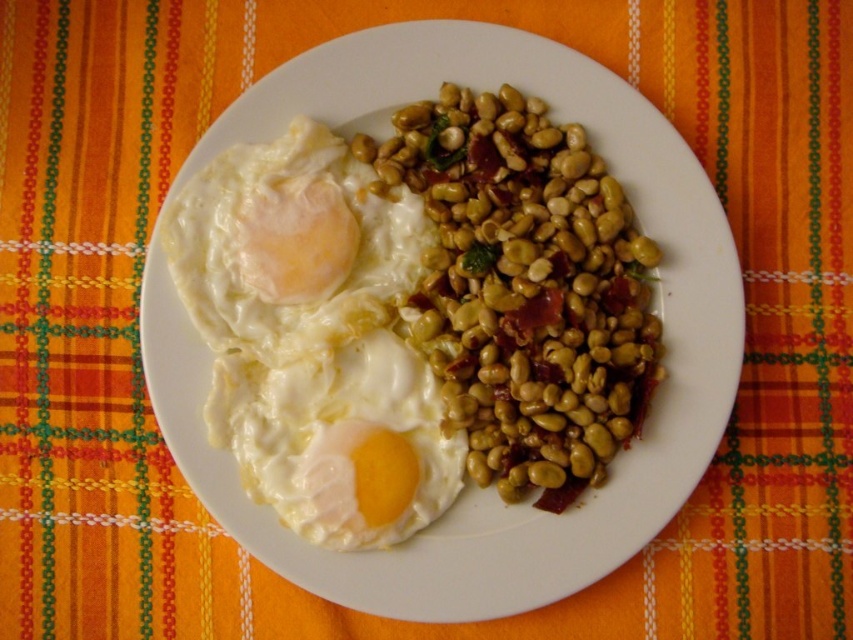
Question: Can you confirm if green matte beans at center is positioned above white creamy egg at center?

Choices:
 (A) no
 (B) yes

Answer: (B)

Question: Is green matte beans at center further to the viewer compared to white matte fried egg at upper left?

Choices:
 (A) yes
 (B) no

Answer: (B)

Question: Which of the following is the farthest from the observer?

Choices:
 (A) white matte fried egg at upper left
 (B) white creamy egg at center
 (C) green matte beans at center

Answer: (B)

Question: Can you confirm if white matte fried egg at upper left is bigger than white creamy egg at center?

Choices:
 (A) yes
 (B) no

Answer: (A)

Question: Which point is farther to the camera?

Choices:
 (A) (583, 456)
 (B) (274, 442)

Answer: (B)

Question: Which point is closer to the camera taking this photo?

Choices:
 (A) (215, 157)
 (B) (515, 221)
 (C) (329, 337)

Answer: (A)